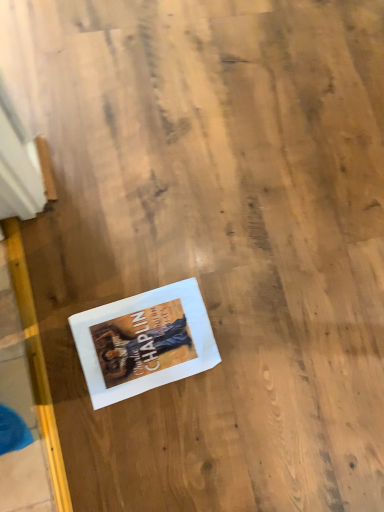
Locate an element on the screen. The width and height of the screenshot is (384, 512). free location above white paper book at center (from a real-world perspective) is located at coordinates (150, 340).